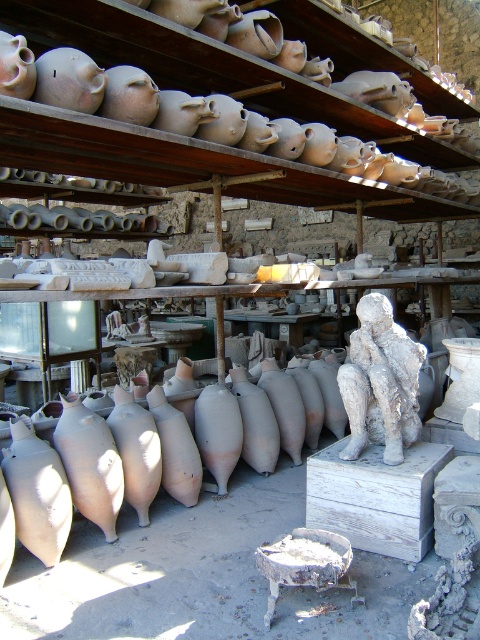
From the picture: You are an artist trying to place a new sculpture in the pottery workshop. You want to position it so that it aligns with the existing arrangement. Based on the scene, where should you place the new sculpture relative to the matte clay pots at upper center and the white stone statue at center?

The matte clay pots at upper center are to the left of the white stone statue at center, so you should place the new sculpture to the right of the matte clay pots at upper center and to the left of the white stone statue at center to maintain alignment with the existing arrangement.